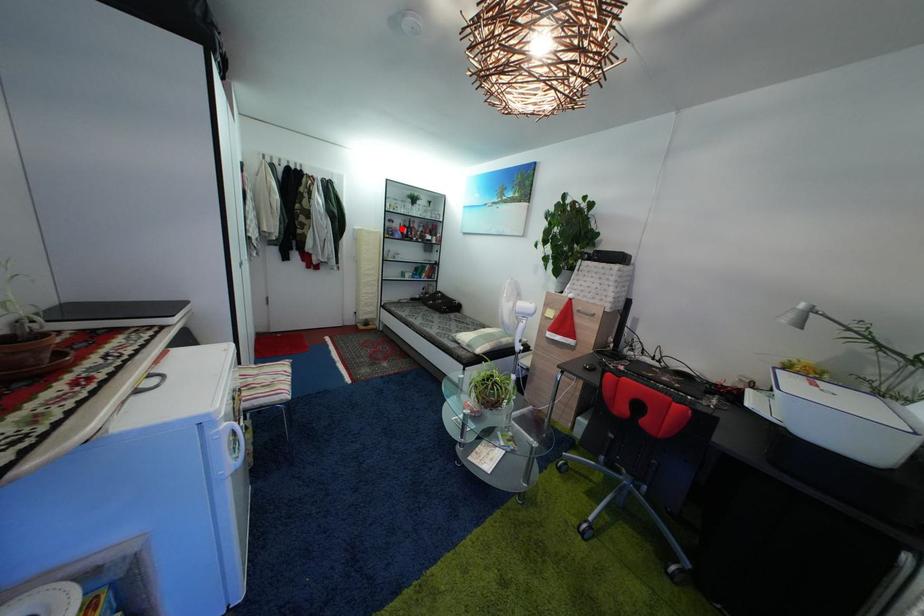
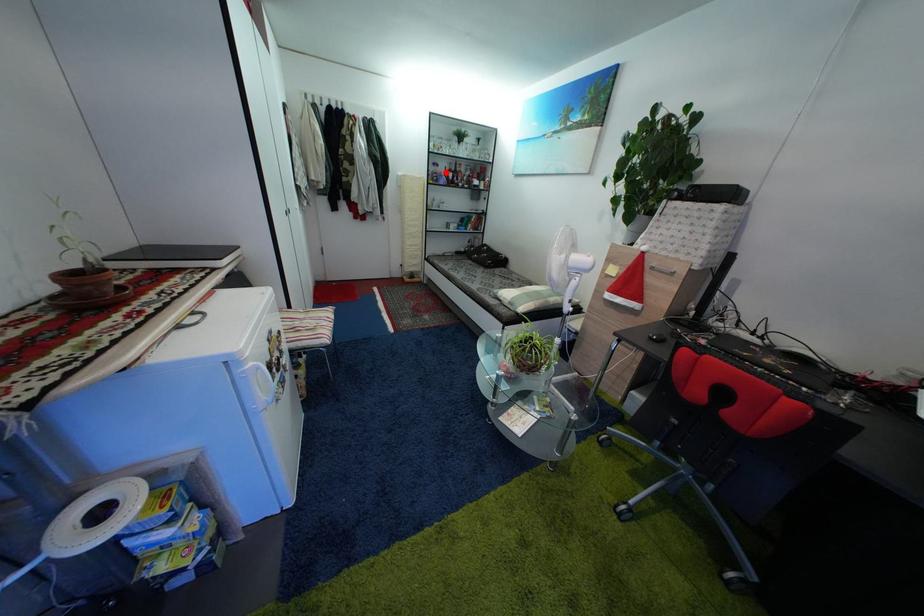
I am providing you with two images of the same scene from different viewpoints. A red point is marked on the first image and another point is marked on the second image. Is the marked point in image1 the same physical position as the marked point in image2?

Yes